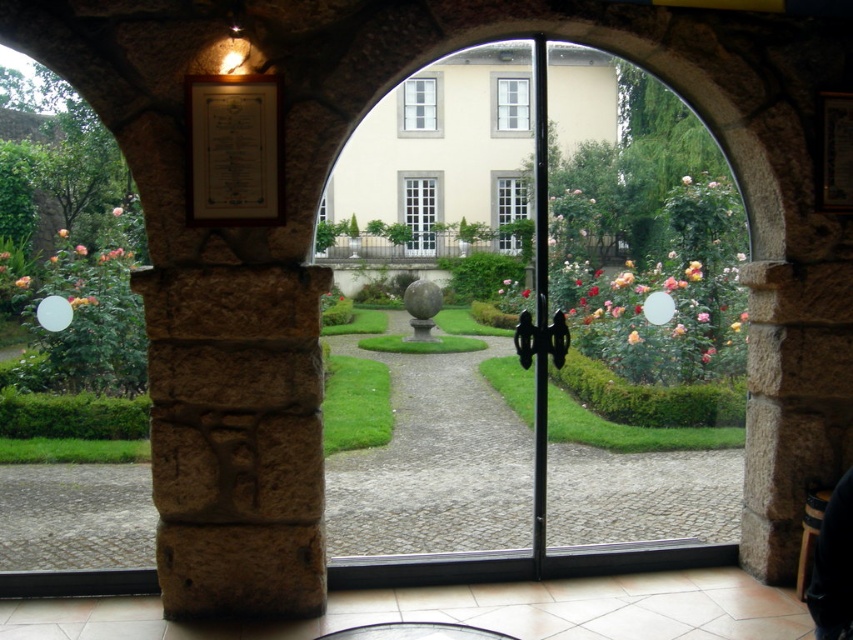
Question: Observing the image, what is the correct spatial positioning of clear glass door at center in reference to white tile floor at center?

Choices:
 (A) left
 (B) right

Answer: (B)

Question: Considering the relative positions of clear glass door at center and white tile floor at center in the image provided, where is clear glass door at center located with respect to white tile floor at center?

Choices:
 (A) left
 (B) right

Answer: (B)

Question: Can you confirm if clear glass door at center is thinner than white tile floor at center?

Choices:
 (A) yes
 (B) no

Answer: (B)

Question: Which object appears closest to the camera in this image?

Choices:
 (A) white tile floor at center
 (B) clear glass door at center

Answer: (A)

Question: Which point is farther to the camera?

Choices:
 (A) clear glass door at center
 (B) white tile floor at center

Answer: (A)